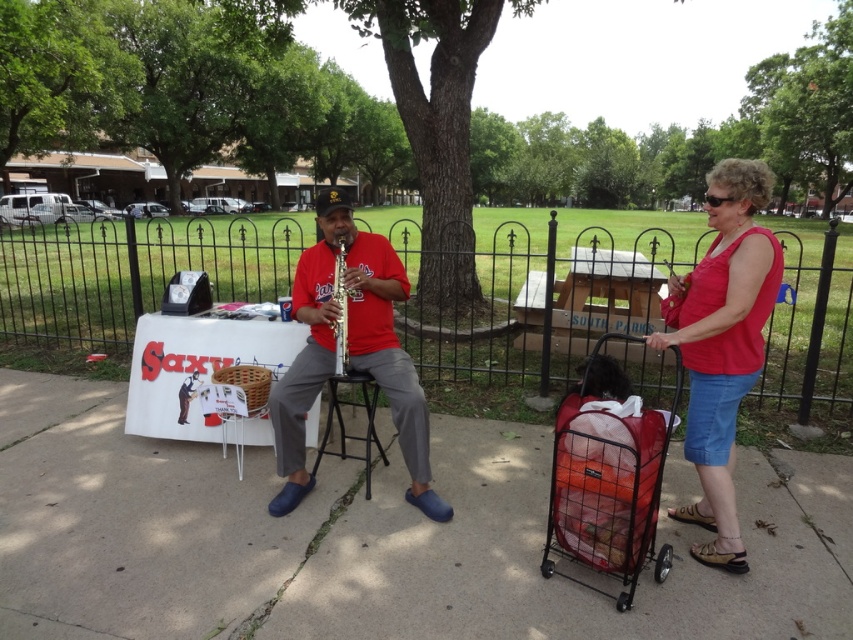
Question: Is matte red shirt at center thinner than red mesh shopping cart at right?

Choices:
 (A) no
 (B) yes

Answer: (A)

Question: Which object appears closest to the camera in this image?

Choices:
 (A) concrete sidewalk at center
 (B) matte red shirt at center
 (C) shiny gold saxophone at center
 (D) matte red tank top at right

Answer: (A)

Question: Considering the real-world distances, which object is closest to the matte red tank top at right?

Choices:
 (A) concrete sidewalk at center
 (B) red mesh shopping cart at right
 (C) shiny gold saxophone at center

Answer: (B)

Question: Among these points, which one is farthest from the camera?

Choices:
 (A) (596, 476)
 (B) (341, 262)
 (C) (390, 396)

Answer: (B)

Question: Does concrete sidewalk at center appear over matte red tank top at right?

Choices:
 (A) yes
 (B) no

Answer: (B)

Question: Where is concrete sidewalk at center located in relation to matte red shirt at center in the image?

Choices:
 (A) left
 (B) right

Answer: (B)